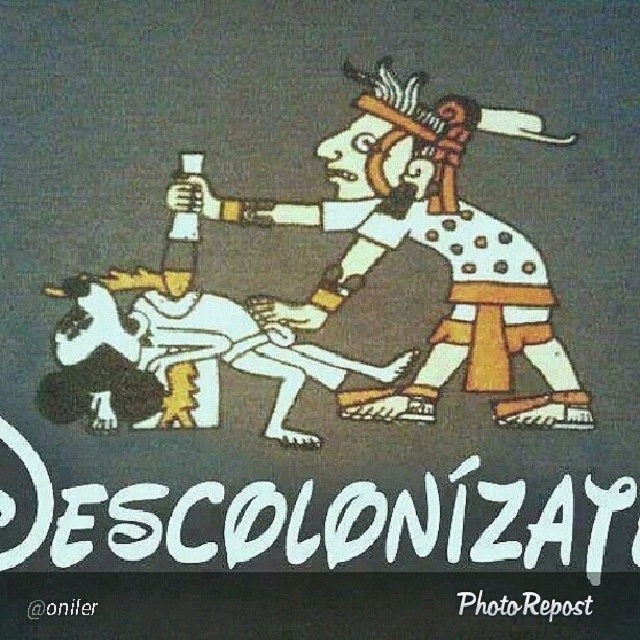
Question: Can you confirm if white paper at lower center is bigger than black paper at lower left?

Choices:
 (A) yes
 (B) no

Answer: (A)

Question: Is white paper text at center above black paper at lower left?

Choices:
 (A) yes
 (B) no

Answer: (A)

Question: Among these objects, which one is nearest to the camera?

Choices:
 (A) white paper at lower center
 (B) white paper text at center

Answer: (A)

Question: Can you confirm if white matte figure at center is wider than black paper at lower left?

Choices:
 (A) no
 (B) yes

Answer: (B)

Question: Among these objects, which one is nearest to the camera?

Choices:
 (A) white paper text at center
 (B) white paper at lower center
 (C) white matte figure at center

Answer: (B)

Question: Which of the following is the farthest from the observer?

Choices:
 (A) (74, 614)
 (B) (312, 481)
 (C) (332, 300)

Answer: (C)